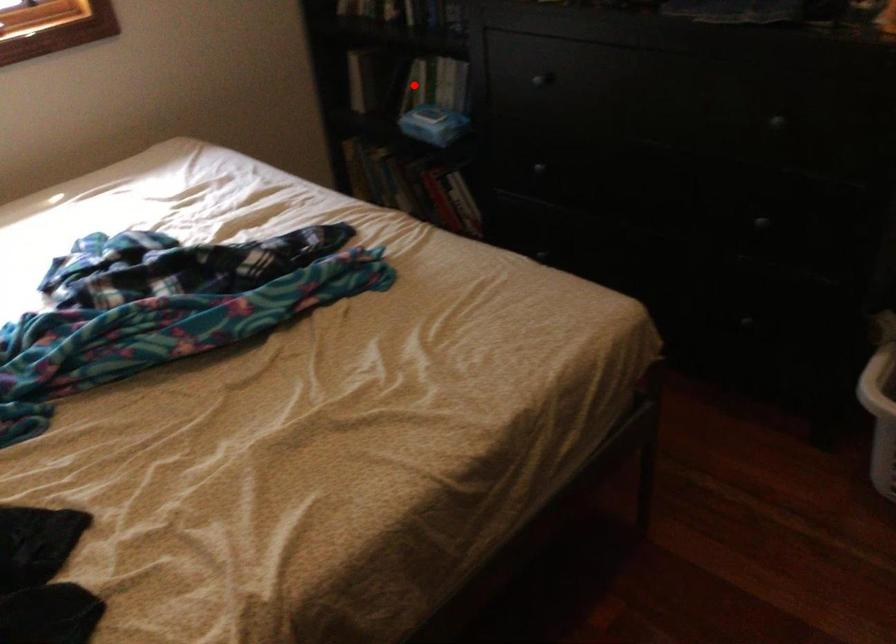
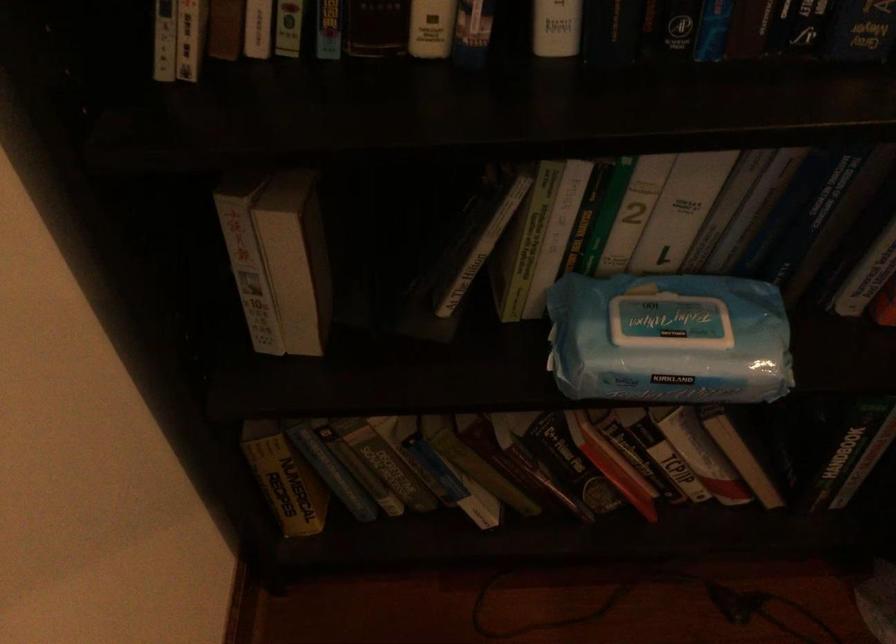
Question: I am providing you with two images of the same scene from different viewpoints. Given a red point in image1, look at the same physical point in image2. Is it:

Choices:
 (A) Closer to the viewpoint
 (B) Farther from the viewpoint

Answer: (A)